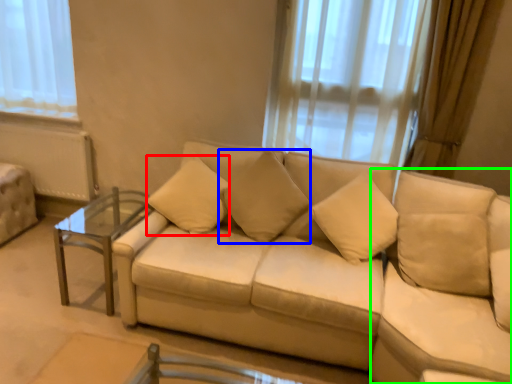
Question: Which object is positioned closest to pillow (highlighted by a red box)? Select from pillow (highlighted by a blue box) and swivel chair (highlighted by a green box).

Choices:
 (A) pillow
 (B) swivel chair

Answer: (A)